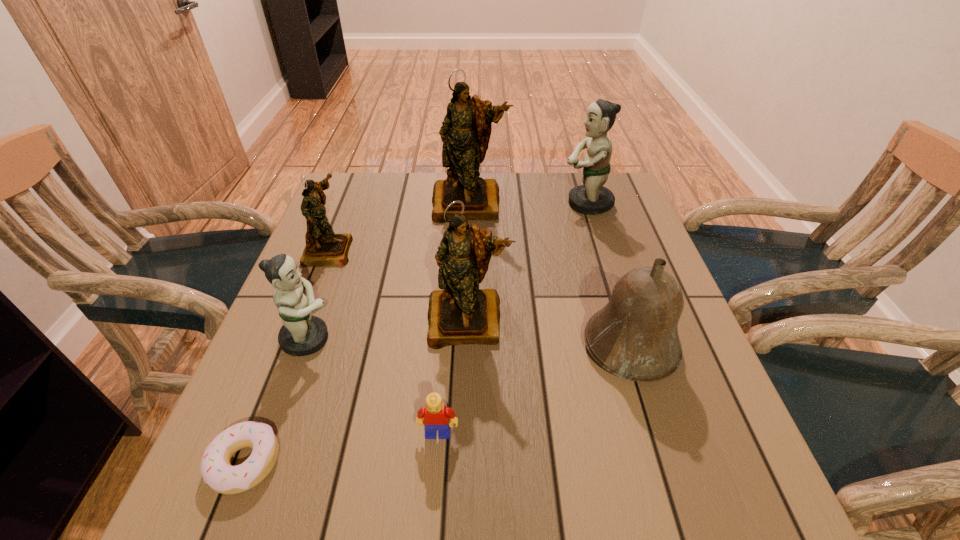
The width and height of the screenshot is (960, 540). I want to click on Lego, so click(436, 415).

You are a GUI agent. You are given a task and a screenshot of the screen. Output one action in this format:
    pyautogui.click(x=<x>, y=<y>)
    Task: Click on the shortest object
    Image resolution: width=960 pixels, height=540 pixels.
    Given the screenshot: What is the action you would take?
    pyautogui.click(x=222, y=477)

The width and height of the screenshot is (960, 540). What are the coordinates of `doughnut` in the screenshot? It's located at (222, 477).

Where is `vacant space positioned 0.060m on the front-facing side of the tallest figurine`? vacant space positioned 0.060m on the front-facing side of the tallest figurine is located at coordinates [x=468, y=237].

At what (x,y) coordinates should I click in order to perform the action: click on vacant space located 0.310m on the front-facing side of the rightmost figurine. Please return your answer as a coordinate pair (x, y). Looking at the image, I should click on (455, 204).

You are a GUI agent. You are given a task and a screenshot of the screen. Output one action in this format:
    pyautogui.click(x=<x>, y=<y>)
    Task: Click on the free location located on the front-facing side of the rightmost figurine
    
    Given the screenshot: What is the action you would take?
    pyautogui.click(x=479, y=204)

Find the location of a particular element. The width and height of the screenshot is (960, 540). free location located on the front-facing side of the rightmost figurine is located at coordinates (482, 204).

Locate an element on the screen. vacant space located on the front-facing side of the nearest gold figurine is located at coordinates (463, 518).

At what (x,y) coordinates should I click in order to perform the action: click on vacant region located on the front of the bell. Please return your answer as a coordinate pair (x, y). The height and width of the screenshot is (540, 960). Looking at the image, I should click on (651, 410).

The width and height of the screenshot is (960, 540). What are the coordinates of `free space located 0.260m on the front-facing side of the second nearest gold figurine` in the screenshot? It's located at (453, 250).